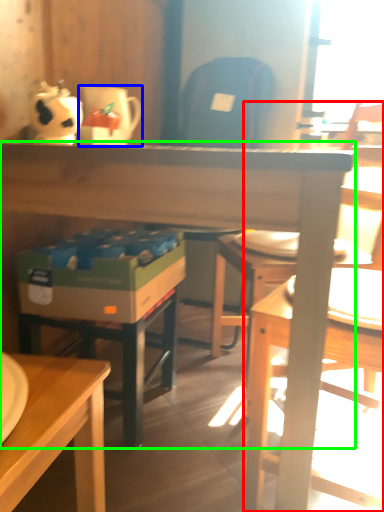
Question: Which object is positioned farthest from chair (highlighted by a red box)? Select from coffee cup (highlighted by a blue box) and desk (highlighted by a green box).

Choices:
 (A) coffee cup
 (B) desk

Answer: (A)